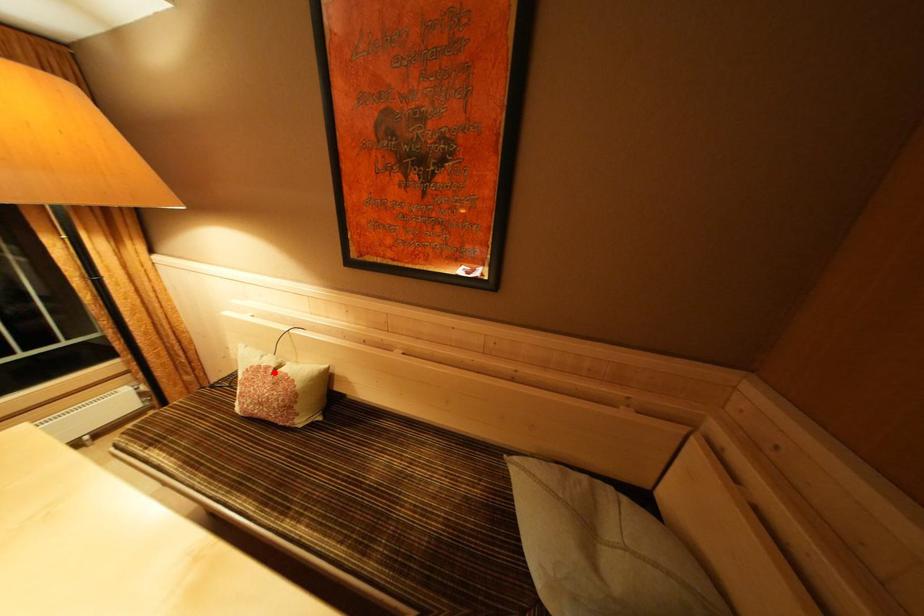
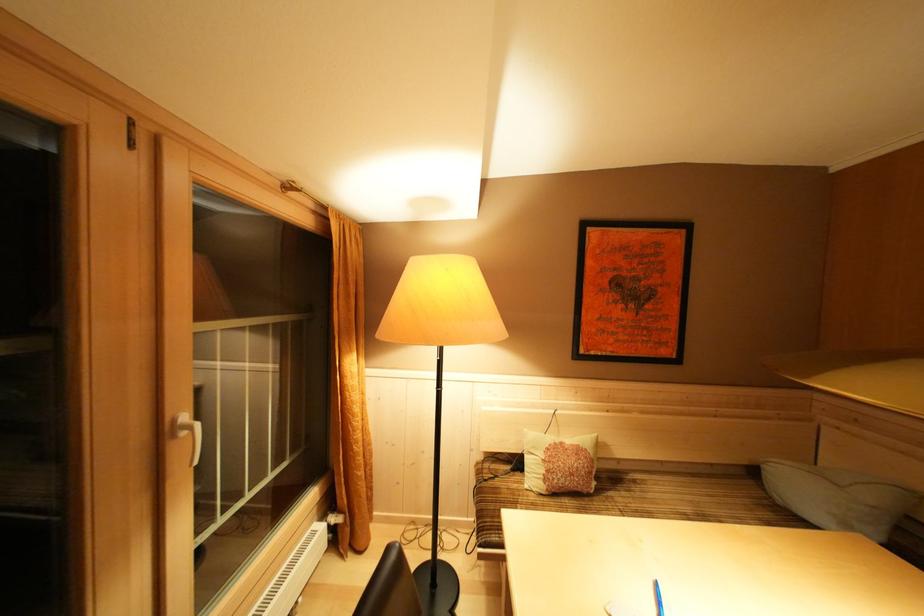
Question: I am providing you with two images of the same scene from different viewpoints. In image1, a red point is highlighted. Considering the same 3D point in image2, which of the following is correct?

Choices:
 (A) It is closer
 (B) It is farther

Answer: (B)